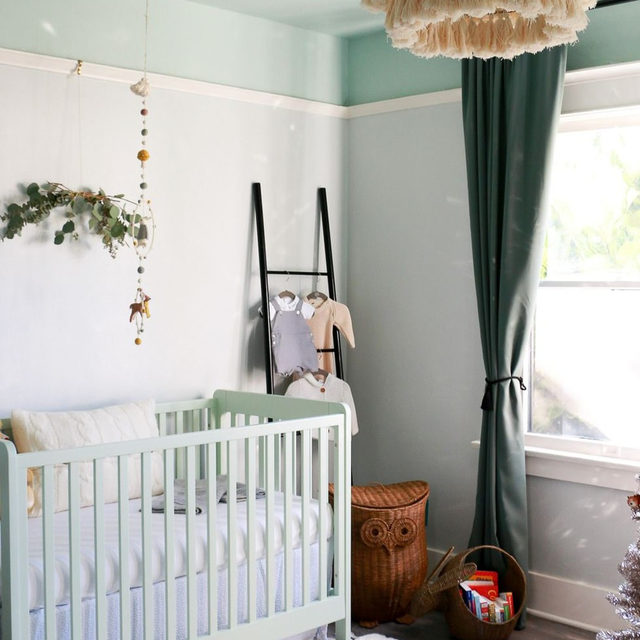
Identify the location of books. This screenshot has height=640, width=640. (490, 605).